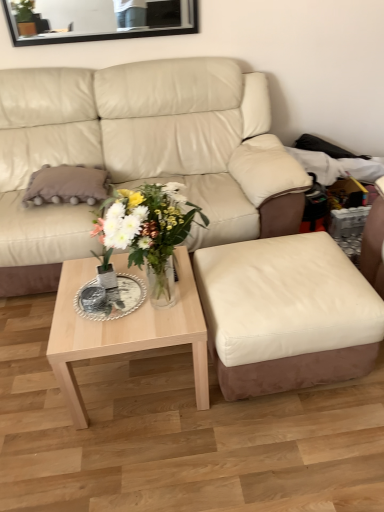
Locate an element on the screen. The width and height of the screenshot is (384, 512). vacant space to the left of light wood/texture coffee table at center is located at coordinates (33, 381).